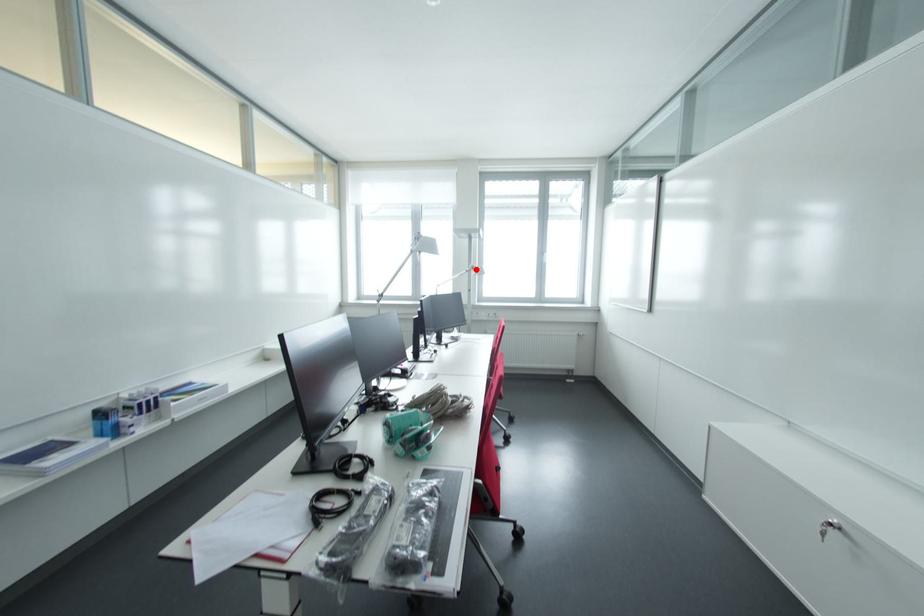
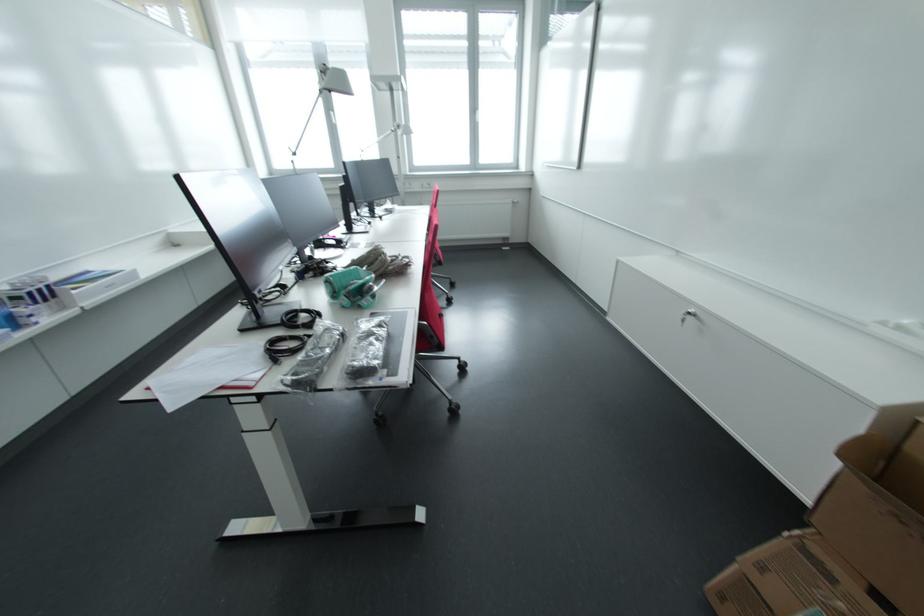
In the second image, find the point that corresponds to the highlighted location in the first image.

(403, 128)